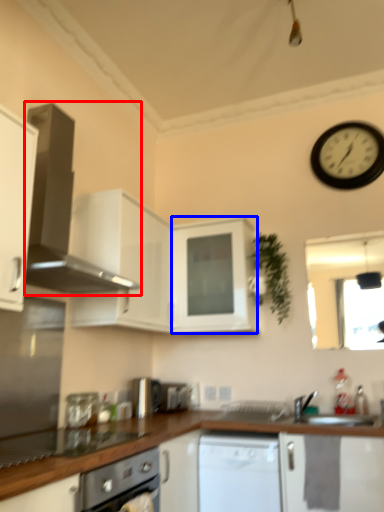
Question: Which of the following is the farthest to the observer, home appliance (highlighted by a red box) or cabinetry (highlighted by a blue box)?

Choices:
 (A) home appliance
 (B) cabinetry

Answer: (B)